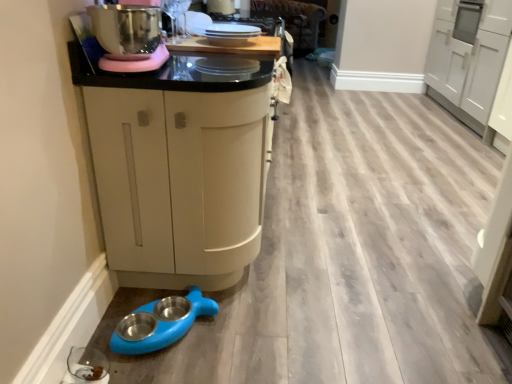
Question: In terms of height, does wooden surface at upper center look taller or shorter compared to white glossy plates at upper center, which ranks as the 2th appliance in front-to-back order?

Choices:
 (A) tall
 (B) short

Answer: (B)

Question: Considering the positions of wooden surface at upper center and white glossy plates at upper center, positioned as the first appliance in top-to-bottom order, in the image, is wooden surface at upper center wider or thinner than white glossy plates at upper center, positioned as the first appliance in top-to-bottom order,?

Choices:
 (A) thin
 (B) wide

Answer: (B)

Question: Considering the real-world distances, which object is farthest from the matte cream cabinet at center, acting as the 1th cabinetry starting from the front?

Choices:
 (A) transparent glass bowl at lower left, positioned as the 1th appliance in front-to-back order
 (B) blue rubber pet bowls at lower left
 (C) wooden surface at upper center
 (D) white glossy cabinet at upper right, which is the 1th cabinetry from back to front
 (E) white glossy plates at upper center, which ranks as the 2th appliance in front-to-back order

Answer: (D)

Question: Considering the real-world distances, which object is farthest from the white glossy cabinet at upper right, arranged as the 1th cabinetry when viewed from the right?

Choices:
 (A) transparent glass bowl at lower left, acting as the second appliance starting from the top
 (B) white glossy plates at upper center, arranged as the first appliance when viewed from the back
 (C) matte cream cabinet at center, which ranks as the 2th cabinetry in back-to-front order
 (D) wooden surface at upper center
 (E) blue rubber pet bowls at lower left

Answer: (A)